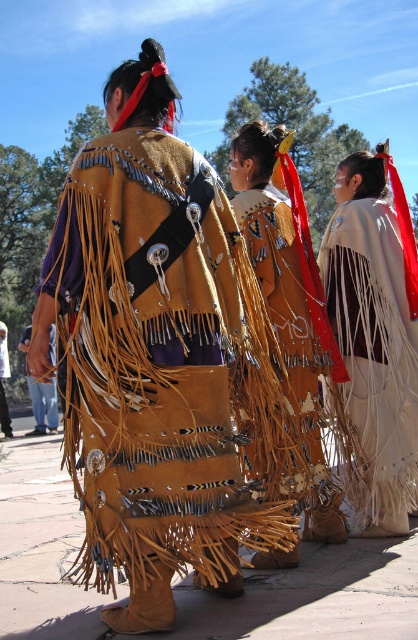
Question: Which of these objects is positioned closest to the leather fringe vest at center?

Choices:
 (A) brown suede cape at center
 (B) brown suede vest at center
 (C) white fringed cape at center
 (D) leather fringe vest at lower left

Answer: (A)

Question: Which point is closer to the camera taking this photo?

Choices:
 (A) (53, 412)
 (B) (354, 177)
 (C) (188, 380)
 (D) (4, 336)

Answer: (C)

Question: Among these objects, which one is nearest to the camera?

Choices:
 (A) leather fringe vest at lower left
 (B) brown suede vest at center
 (C) leather fringe vest at center
 (D) brown suede cape at center

Answer: (C)

Question: Can you confirm if white fringed cape at center is positioned below brown suede cape at center?

Choices:
 (A) no
 (B) yes

Answer: (B)

Question: Is brown suede cape at center to the right of brown suede vest at center from the viewer's perspective?

Choices:
 (A) no
 (B) yes

Answer: (B)

Question: Where is leather fringe vest at center located in relation to brown suede cape at center in the image?

Choices:
 (A) right
 (B) left

Answer: (B)